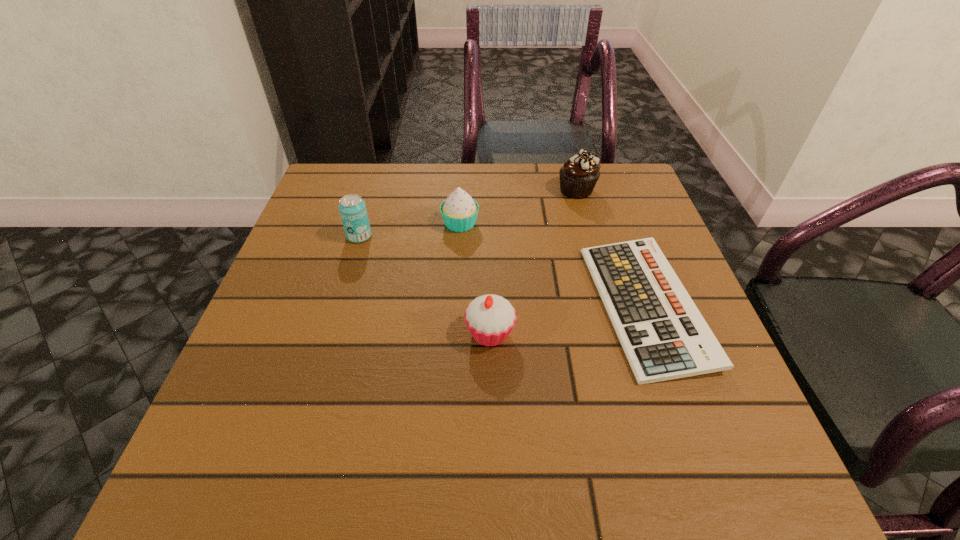
Locate an element on the screen. vacant area situated on the back of the computer keyboard is located at coordinates (602, 183).

Find the location of `object at the left edge`. object at the left edge is located at coordinates (352, 208).

Locate an element on the screen. The image size is (960, 540). cupcake located in the right edge section of the desktop is located at coordinates (578, 176).

In order to click on computer keyboard at the right edge in this screenshot , I will do `click(664, 336)`.

The image size is (960, 540). What are the coordinates of `object situated at the far right corner` in the screenshot? It's located at (578, 176).

Locate an element on the screen. The width and height of the screenshot is (960, 540). vacant space at the far edge is located at coordinates (485, 183).

This screenshot has height=540, width=960. What are the coordinates of `vacant space at the near edge of the desktop` in the screenshot? It's located at (649, 473).

Where is `free space at the left edge of the desktop`? This screenshot has height=540, width=960. free space at the left edge of the desktop is located at coordinates (222, 409).

At what (x,y) coordinates should I click in order to perform the action: click on vacant space at the right edge of the desktop. Please return your answer as a coordinate pair (x, y). This screenshot has width=960, height=540. Looking at the image, I should click on (733, 416).

You are a GUI agent. You are given a task and a screenshot of the screen. Output one action in this format:
    pyautogui.click(x=<x>, y=<y>)
    Task: Click on the vacant space at the far right corner of the desktop
    This screenshot has height=540, width=960.
    Given the screenshot: What is the action you would take?
    pyautogui.click(x=628, y=215)